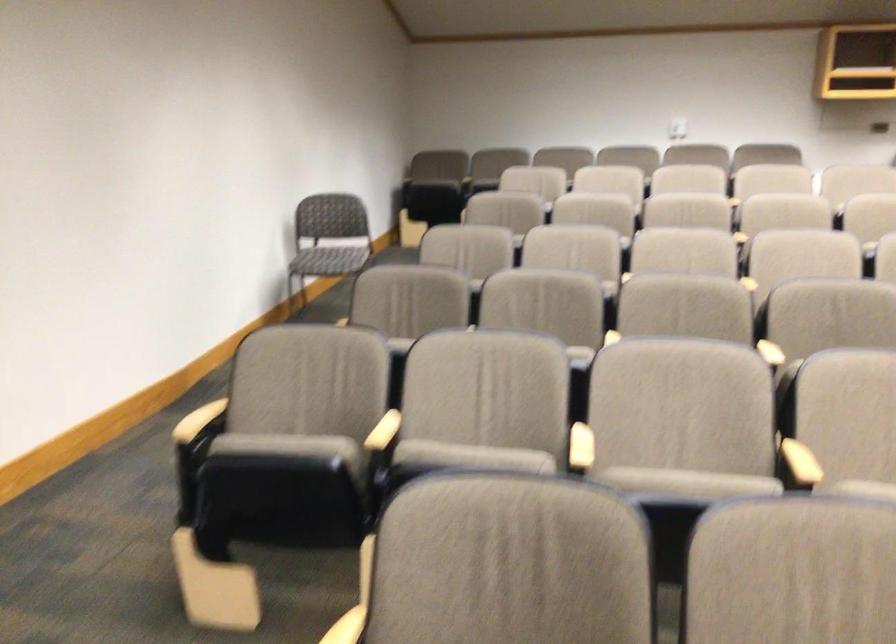
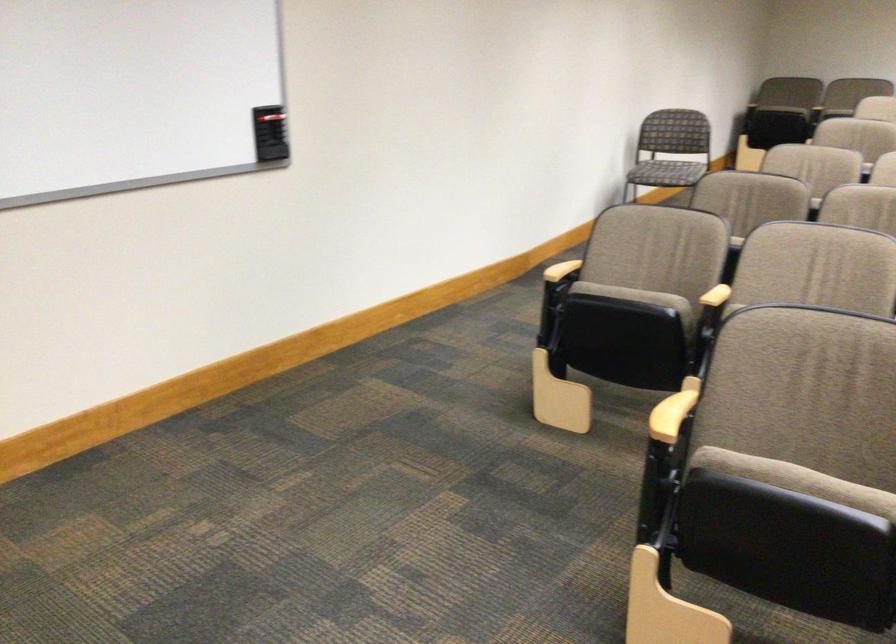
The point at (195, 436) is marked in the first image. Where is the corresponding point in the second image?

(561, 269)